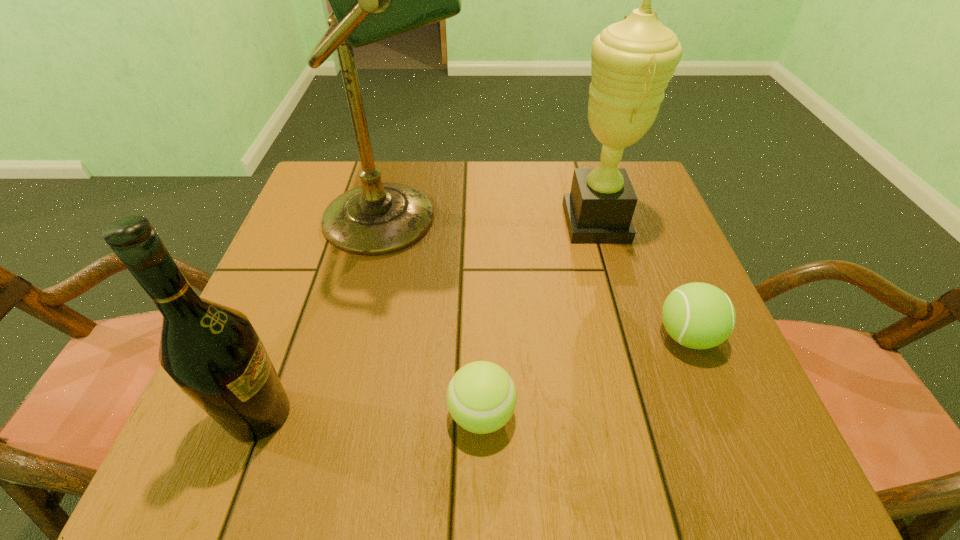
Locate an element on the screen. This screenshot has width=960, height=540. free space between the table lamp and the trophy cup is located at coordinates (496, 220).

Select which object appears as the third closest to the fourth shortest object. Please provide its 2D coordinates. Your answer should be formatted as a tuple, i.e. [(x, y)], where the tuple contains the x and y coordinates of a point satisfying the conditions above.

[(481, 397)]

Find the location of a particular element. Image resolution: width=960 pixels, height=540 pixels. the second closest object to the trophy cup is located at coordinates (372, 0).

Where is `free space that satisfies the following two spatial constraints: 1. on the back side of the farther tennis ball; 2. above the green lampshade of the table lamp`? This screenshot has height=540, width=960. free space that satisfies the following two spatial constraints: 1. on the back side of the farther tennis ball; 2. above the green lampshade of the table lamp is located at coordinates 639,218.

You are a GUI agent. You are given a task and a screenshot of the screen. Output one action in this format:
    pyautogui.click(x=<x>, y=<y>)
    Task: Click on the vacant space that satisfies the following two spatial constraints: 1. on the back side of the third farthest object; 2. at the front of the trophy cup with handles
    
    Given the screenshot: What is the action you would take?
    pyautogui.click(x=641, y=222)

You are a GUI agent. You are given a task and a screenshot of the screen. Output one action in this format:
    pyautogui.click(x=<x>, y=<y>)
    Task: Click on the free location that satisfies the following two spatial constraints: 1. above the green lampshade of the nearer tennis ball; 2. on the right side of the table lamp
    This screenshot has height=540, width=960.
    Given the screenshot: What is the action you would take?
    point(356,414)

Locate an element on the screen. vacant space that satisfies the following two spatial constraints: 1. above the green lampshade of the nearer tennis ball; 2. on the left side of the table lamp is located at coordinates [x=356, y=414].